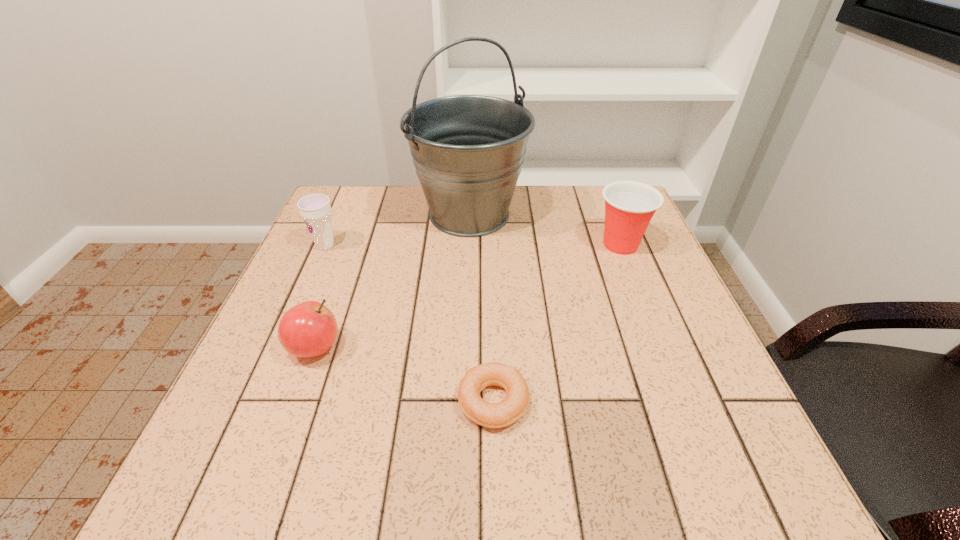
Where is `free space at the left edge of the desktop`? This screenshot has width=960, height=540. free space at the left edge of the desktop is located at coordinates (345, 246).

Identify the location of vacant region at the right edge of the desktop. (626, 341).

In the image, there is a desktop. Identify the location of vacant region at the far left corner. (384, 190).

Find the location of `vacant area at the near left corner of the desktop`. vacant area at the near left corner of the desktop is located at coordinates (257, 444).

You are a GUI agent. You are given a task and a screenshot of the screen. Output one action in this format:
    pyautogui.click(x=<x>, y=<y>)
    Task: Click on the free space at the far right corner
    The image size is (960, 540).
    Given the screenshot: What is the action you would take?
    pyautogui.click(x=575, y=186)

The image size is (960, 540). Find the location of `free space at the near right corner of the desktop`. free space at the near right corner of the desktop is located at coordinates (744, 502).

Find the location of a particular element. vacant point located between the bucket and the nearest object is located at coordinates (481, 308).

Identify the location of vacant region between the right cup and the bagel. (557, 323).

Locate an element on the screen. empty space that is in between the tallest object and the left cup is located at coordinates (397, 230).

Locate an element on the screen. This screenshot has height=540, width=960. unoccupied position between the apple and the bucket is located at coordinates (393, 281).